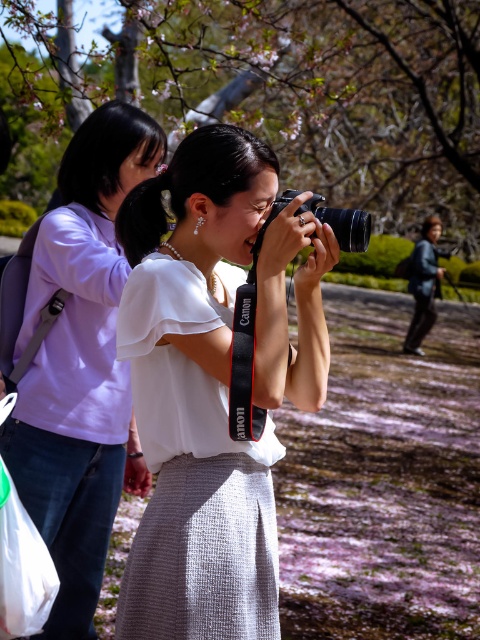
You are a photographer trying to capture both the matte white shirt at upper left and the dark gray fabric jacket at right in a single frame. Based on their sizes in the image, which one should you focus on first to ensure both are in focus?

The matte white shirt at upper left occupies less space than the dark gray fabric jacket at right, so you should focus on the dark gray fabric jacket at right first since it is larger and will require more attention to ensure sharpness throughout its entirety.

You are a photographer trying to capture a group photo of the matte white shirt at upper left and the white textured dress at center. Which person should stand to the left to frame the shot properly?

The matte white shirt at upper left should stand to the left since it is already positioned on the left side of the white textured dress at center.